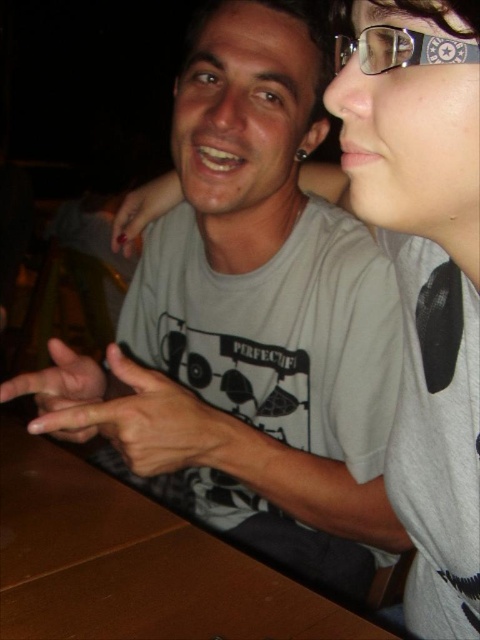
You are a photographer at the event and need to capture a closeup of both the matte gray hands at center and the nail polish at left. Which object should you zoom in on more to ensure they appear the same size in the photo?

The matte gray hands at center is smaller than the nail polish at left, so you should zoom in more on the matte gray hands at center to make them appear the same size as the nail polish at left in the photo.

You are a photographer taking a portrait of the two people in the scene. You want to focus on the matte skin hand at center. Is the hand within the optimal focus range of your camera, which requires subjects to be between 50 and 60 centimeters away?

The matte skin hand at center is 58.56 centimeters away from the camera, which falls within the optimal focus range of 50 to 60 centimeters. Therefore, the hand is within the optimal focus range.

Looking at this image, you are at a social gathering and need to place a 30 cm wide photo frame on the table. The clear plastic glasses at upper right are already occupying space on the brown wooden table at center. Based on the scene, can the photo frame fit on the table without moving the glasses?

The brown wooden table at center is wider than the clear plastic glasses at upper right, so the photo frame can likely fit on the table without moving the glasses, as there is enough space remaining.